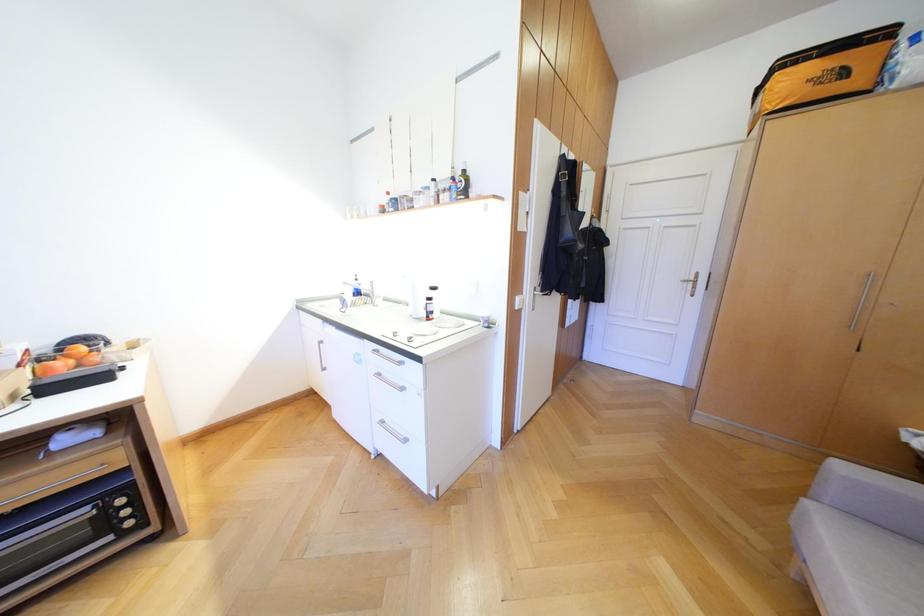
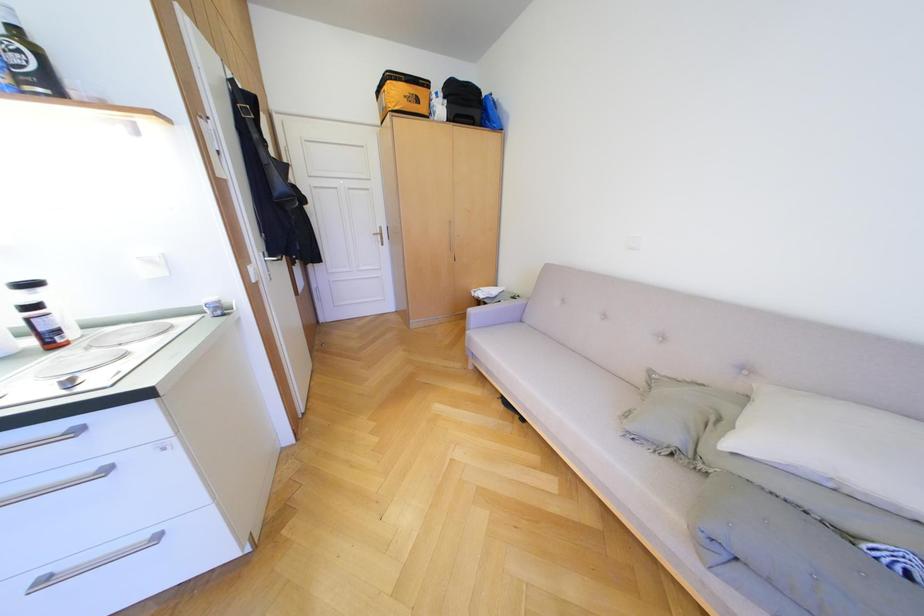
The first image is from the beginning of the video and the second image is from the end. How did the camera likely rotate when shooting the video?

The camera's rotation is toward right-down.